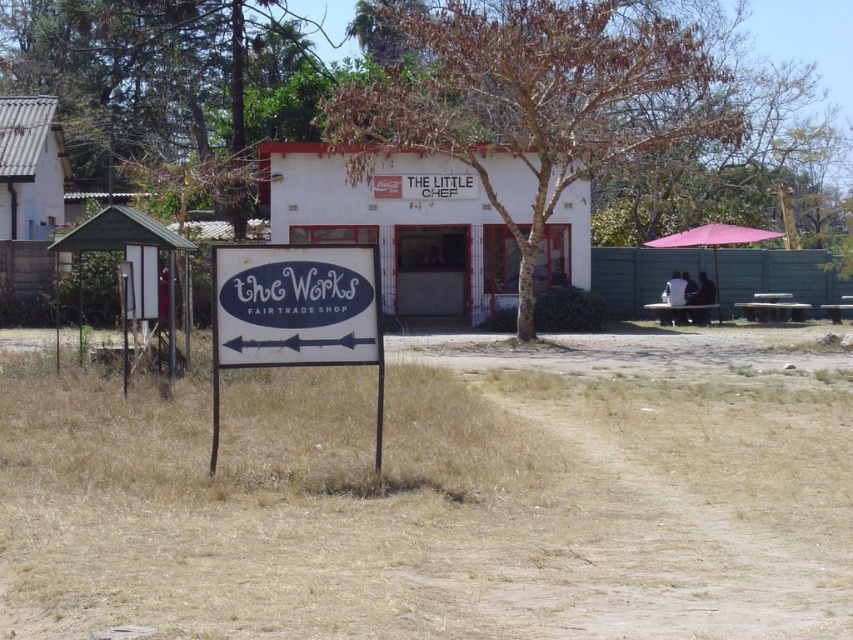
You are standing in front of The Little Chef building and want to place a new sign between the brown dry grass at center and the pink fabric umbrella at right. Which object should the sign be placed closer to if you want it to be more visible? Explain your reasoning based on their heights.

The sign should be placed closer to the pink fabric umbrella at right because the brown dry grass at center is shorter than the pink fabric umbrella at right, making the umbrella a better reference point for visibility.

You are standing at the entrance of The Little Chef and want to reach the two points marked in the image. Which point, point (25, 602) or point (306, 326), is closer to you?

Point (25, 602) is closer to the viewer than point (306, 326).

You are standing in front of The Little Chef building and want to read the white plastic sign at center. Do you need to walk under the pink fabric umbrella at right to see it clearly?

The white plastic sign at center is positioned under the pink fabric umbrella at right, so you would need to walk under the pink fabric umbrella at right to access or read the sign.